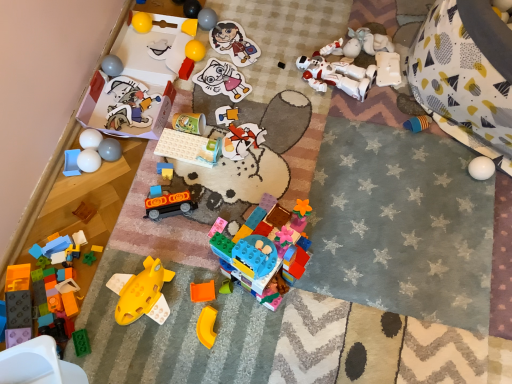
This screenshot has width=512, height=384. I want to click on free space between matte plastic sticker at upper center, which is the 20th toy from left to right, and matte paper sticker at center, which appears as the 6th toy when viewed from the right, so click(x=230, y=67).